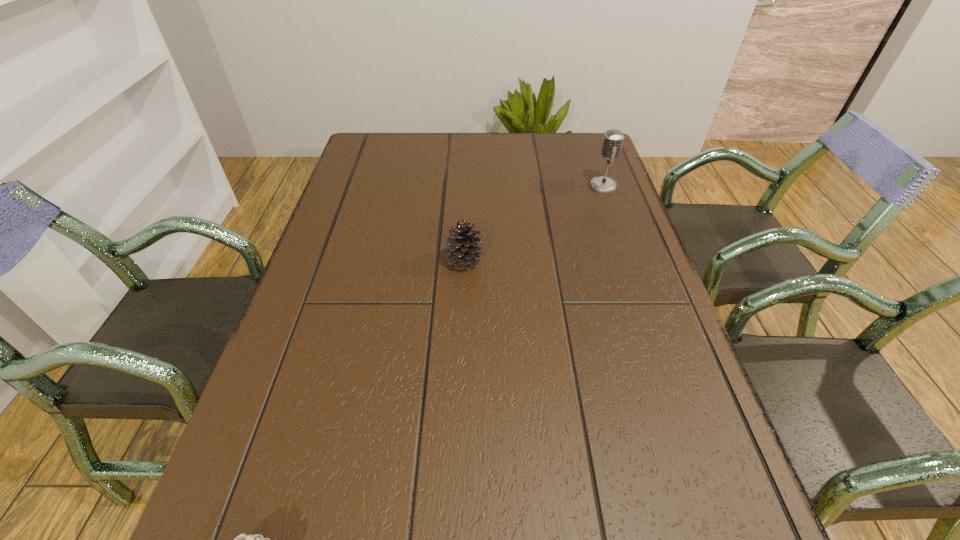
The height and width of the screenshot is (540, 960). In order to click on microphone in this screenshot , I will do `click(613, 139)`.

Locate an element on the screen. This screenshot has width=960, height=540. the tallest object is located at coordinates (613, 139).

Locate an element on the screen. the second shortest object is located at coordinates [x=463, y=251].

Locate an element on the screen. The image size is (960, 540). the second nearest object is located at coordinates 463,251.

Image resolution: width=960 pixels, height=540 pixels. Identify the location of free region located on the back of the rightmost object. (597, 168).

The height and width of the screenshot is (540, 960). What are the coordinates of `free space located on the back of the second tallest object` in the screenshot? It's located at tap(466, 217).

Identify the location of object positioned at the right edge. (613, 139).

In the image, there is a desktop. Find the location of `blank space at the left edge`. blank space at the left edge is located at coordinates (380, 187).

Image resolution: width=960 pixels, height=540 pixels. Find the location of `free space at the right edge of the desktop`. free space at the right edge of the desktop is located at coordinates (676, 487).

The image size is (960, 540). I want to click on blank space at the far left corner of the desktop, so click(398, 142).